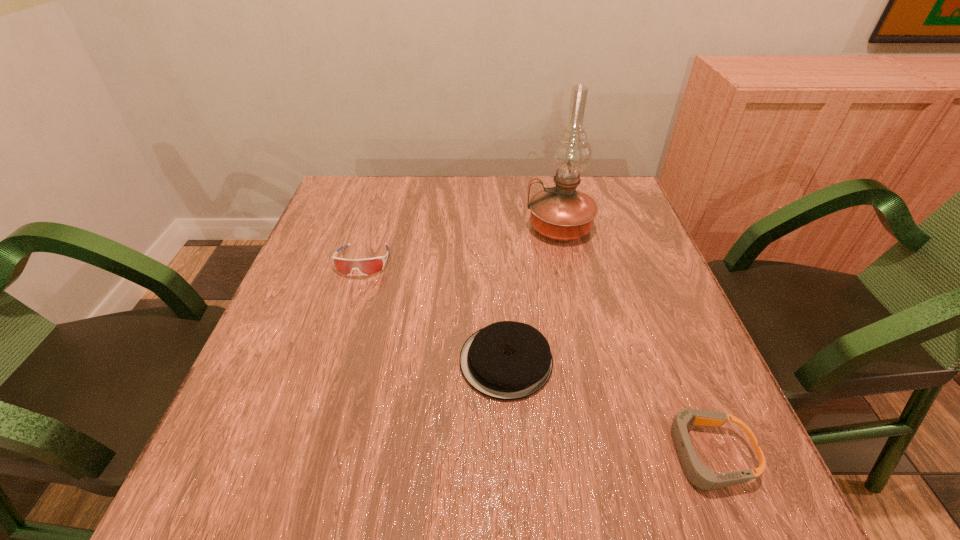
In order to click on oil lamp in this screenshot , I will do `click(561, 213)`.

Where is `the leftmost object`? the leftmost object is located at coordinates (368, 266).

At what (x,y) coordinates should I click in order to perform the action: click on the left goggles. Please return your answer as a coordinate pair (x, y). This screenshot has height=540, width=960. Looking at the image, I should click on (368, 266).

In order to click on pancake in this screenshot , I will do `click(507, 360)`.

The width and height of the screenshot is (960, 540). I want to click on the shortest object, so click(698, 474).

Image resolution: width=960 pixels, height=540 pixels. I want to click on the right goggles, so click(x=698, y=474).

Locate an element on the screen. The image size is (960, 540). vacant space situated 0.290m on the left of the tallest object is located at coordinates (415, 227).

Where is `free space located on the front-facing side of the left goggles`? This screenshot has height=540, width=960. free space located on the front-facing side of the left goggles is located at coordinates (324, 388).

Locate an element on the screen. Image resolution: width=960 pixels, height=540 pixels. free location located on the back of the second nearest object is located at coordinates (499, 240).

This screenshot has width=960, height=540. In order to click on vacant region located 0.270m on the front and back of the nearest object in this screenshot , I will do `click(494, 454)`.